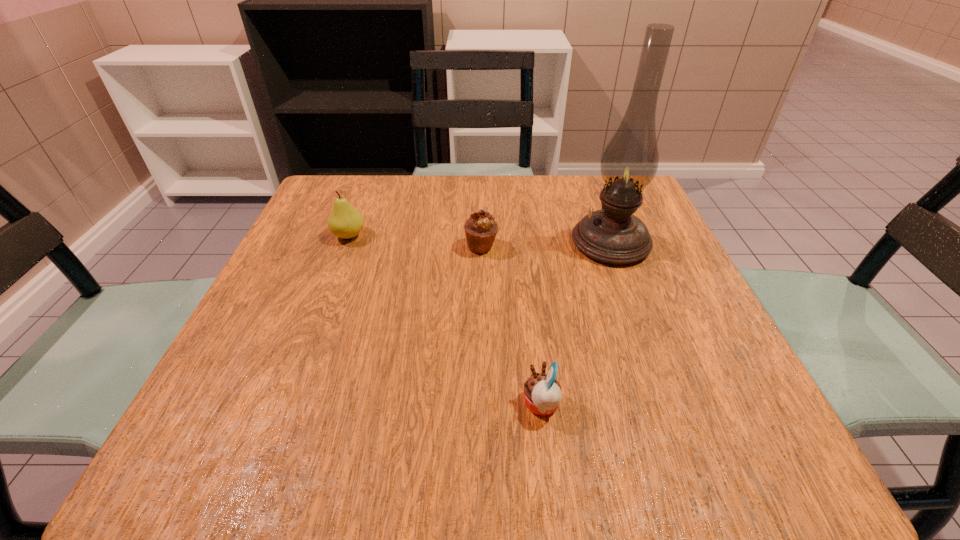
The height and width of the screenshot is (540, 960). Identify the location of oil lamp. (612, 235).

Identify the location of the rightmost object. This screenshot has height=540, width=960. (612, 235).

You are a GUI agent. You are given a task and a screenshot of the screen. Output one action in this format:
    pyautogui.click(x=<x>, y=<y>)
    Task: Click on the pear
    The height and width of the screenshot is (540, 960).
    Given the screenshot: What is the action you would take?
    pyautogui.click(x=345, y=221)

In order to click on the second object from left to right in this screenshot , I will do click(480, 228).

The image size is (960, 540). In order to click on the left muffin in this screenshot , I will do `click(480, 228)`.

Identify the location of the third object from left to right. (542, 392).

You are a GUI agent. You are given a task and a screenshot of the screen. Output one action in this format:
    pyautogui.click(x=<x>, y=<y>)
    Task: Click on the shortest object
    Image resolution: width=960 pixels, height=540 pixels.
    Given the screenshot: What is the action you would take?
    pyautogui.click(x=542, y=392)

The width and height of the screenshot is (960, 540). Identify the location of vacant space located 0.190m on the front of the tallest object. (647, 341).

Where is `free space located 0.140m on the right of the leftmost object`? free space located 0.140m on the right of the leftmost object is located at coordinates (430, 235).

The width and height of the screenshot is (960, 540). Find the location of `free location located 0.380m on the front of the left muffin`. free location located 0.380m on the front of the left muffin is located at coordinates (482, 426).